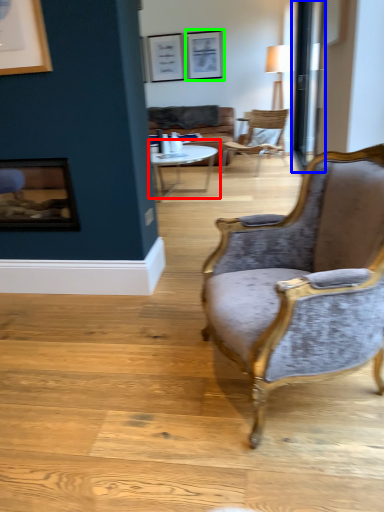
Question: Which object is the closest to the coffee table (highlighted by a red box)? Choose among these: glass door (highlighted by a blue box) or picture frame (highlighted by a green box).

Choices:
 (A) glass door
 (B) picture frame

Answer: (A)